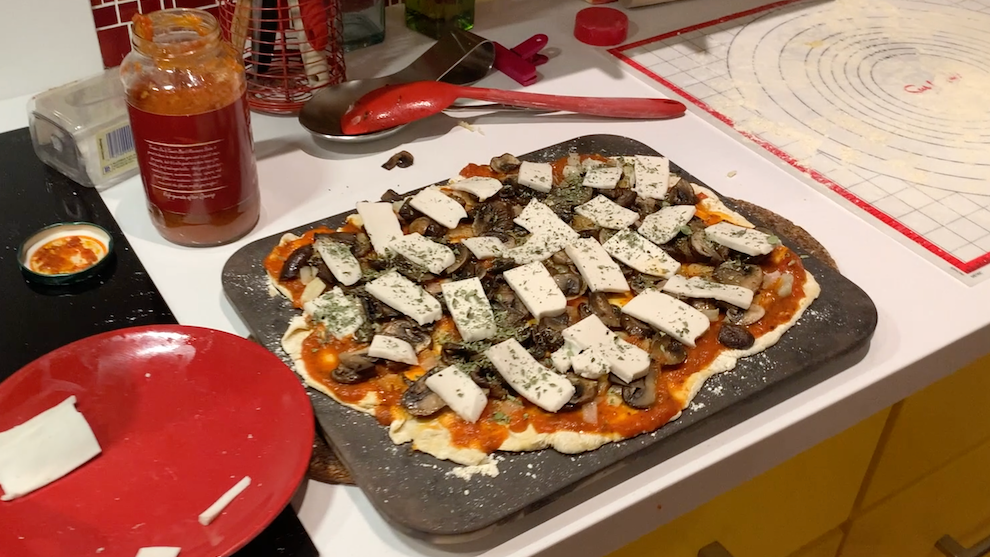
The width and height of the screenshot is (990, 557). I want to click on stove, so click(94, 325).